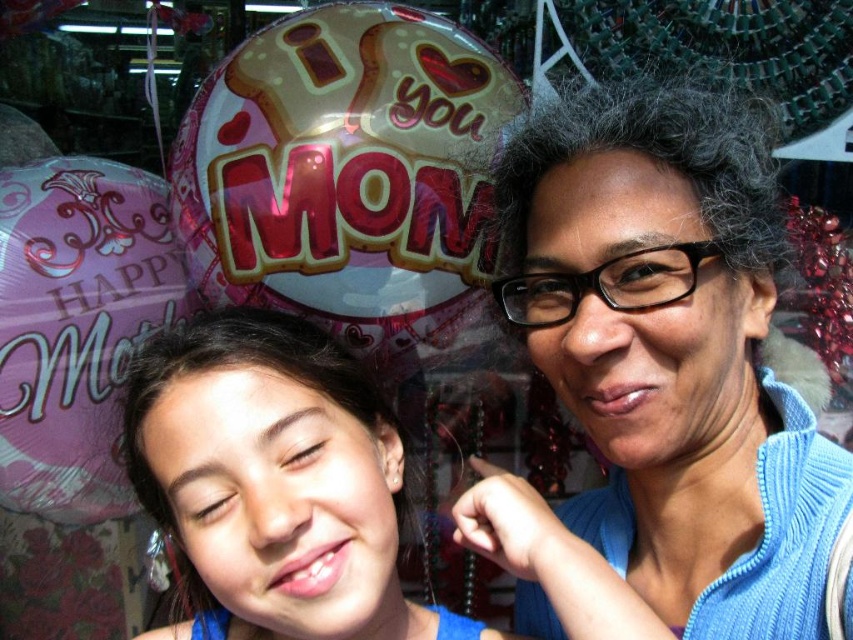
Question: Among these points, which one is nearest to the camera?

Choices:
 (A) (218, 346)
 (B) (383, 150)
 (C) (758, 282)

Answer: (A)

Question: Which of the following is the closest to the observer?

Choices:
 (A) pink metallic balloon at upper center
 (B) smooth blue shirt at center
 (C) blue knitted sweater at center

Answer: (C)

Question: Can you confirm if blue knitted sweater at center is wider than pink metallic balloon at upper center?

Choices:
 (A) no
 (B) yes

Answer: (A)

Question: Is pink metallic balloon at upper center below smooth blue shirt at center?

Choices:
 (A) yes
 (B) no

Answer: (B)

Question: Among these objects, which one is nearest to the camera?

Choices:
 (A) pink metallic balloon at upper center
 (B) smooth blue shirt at center
 (C) pink metallic balloon at left
 (D) blue knitted sweater at center

Answer: (D)

Question: Can you confirm if blue knitted sweater at center is thinner than pink metallic balloon at left?

Choices:
 (A) yes
 (B) no

Answer: (A)